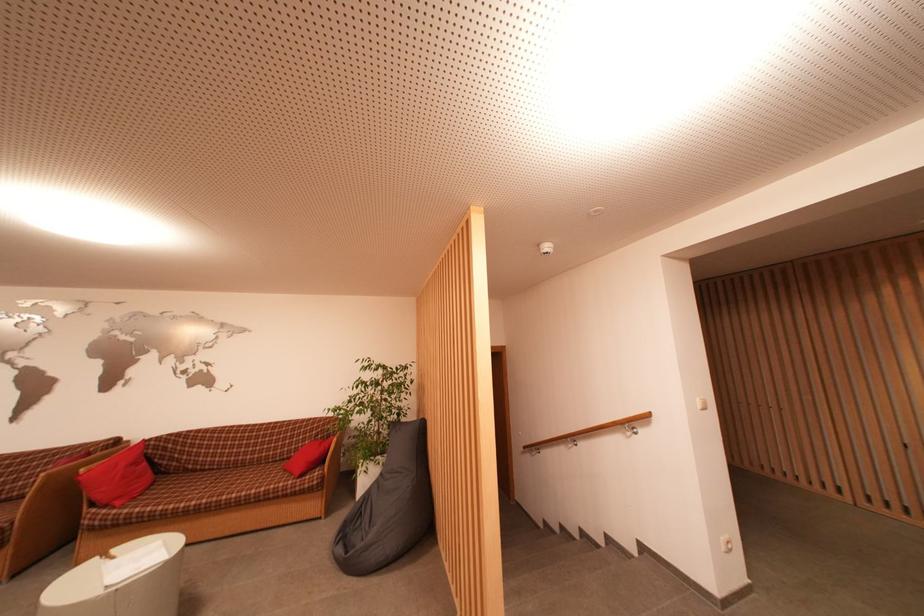
Describe the element at coordinates (708, 430) in the screenshot. Image resolution: width=924 pixels, height=616 pixels. I see `the slatted door handle` at that location.